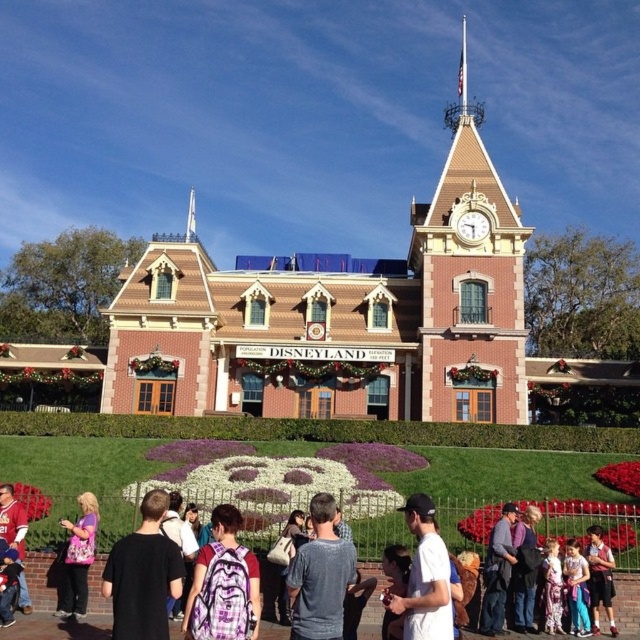
Who is more distant from viewer, (211,412) or (412,564)?

Positioned behind is point (211,412).

Can you confirm if brown textured building at center is shorter than purple plaid backpack at center?

Incorrect, brown textured building at center's height does not fall short of purple plaid backpack at center's.

Is point (365, 358) behind point (99, 560)?

Yes, it is behind point (99, 560).

The height and width of the screenshot is (640, 640). Identify the location of brown textured building at center. (337, 316).

What do you see at coordinates (468, 282) in the screenshot?
I see `matte brown clock tower at upper center` at bounding box center [468, 282].

Does matte brown clock tower at upper center appear under purple plaid backpack at center?

Incorrect, matte brown clock tower at upper center is not positioned below purple plaid backpack at center.

Who is more forward, [420,209] or [36,573]?

Point [36,573]

The height and width of the screenshot is (640, 640). I want to click on matte brown clock tower at upper center, so click(x=468, y=282).

Is gray cotton shirt at center to the left of matte purple shirt at lower left from the viewer's perspective?

Incorrect, gray cotton shirt at center is not on the left side of matte purple shirt at lower left.

The height and width of the screenshot is (640, 640). Find the location of `gray cotton shirt at center`. gray cotton shirt at center is located at coordinates (321, 577).

Does point (333, 608) come in front of point (90, 493)?

Yes, point (333, 608) is closer to viewer.

Identify the location of gray cotton shirt at center. The image size is (640, 640). (321, 577).